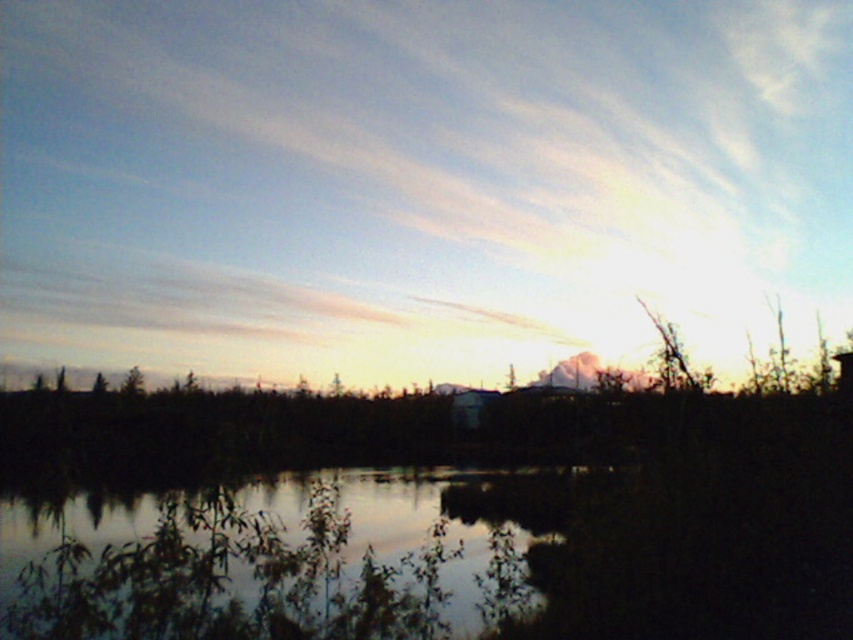
You are an astronomer observing the sky in the image. You notice a point labeled with coordinates. What celestial object is located at point (x=416, y=179)?

The point (x=416, y=179) indicates a white fluffy cloud at upper center.

You are standing at the edge of the silvery reflective water at center and want to reach the white fluffy cloud at upper center. Given that you can walk on water but cannot fly, can you directly walk to the cloud?

The white fluffy cloud at upper center is 149.99 feet away from silvery reflective water at center. However, clouds are located in the sky, so even though you can walk on water, you cannot reach the cloud as it is not on the ground.

You are an artist trying to paint the scene. You want to ensure the white fluffy cloud at upper center and the silvery reflective water at center are positioned correctly. Based on the scene description, which object should be placed higher in your painting?

The white fluffy cloud at upper center should be placed higher in the painting because it is above the silvery reflective water at center according to the description.